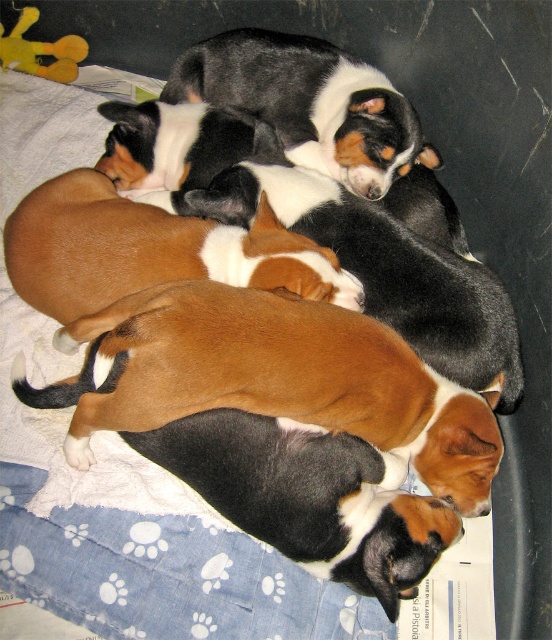
You are a photographer trying to capture a closeup shot of the puppies in the enclosure. You notice two points marked in the image. Which point, point 1 at coordinates (115, 406) or point 2 at coordinates (327, 168), is closer to your camera lens?

Point 1 at coordinates (115, 406) is closer to the camera lens than point 2 at coordinates (327, 168).